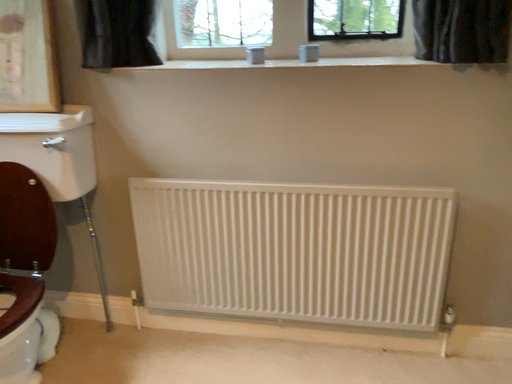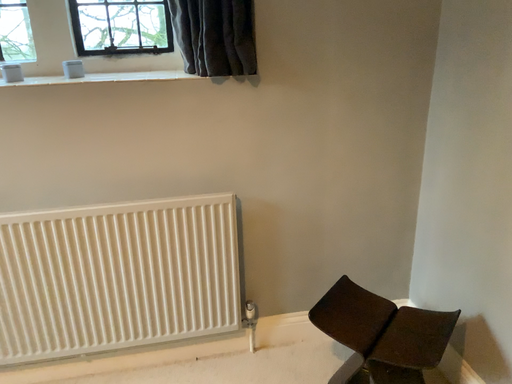
Question: How did the camera likely rotate when shooting the video?

Choices:
 (A) rotated right
 (B) rotated left

Answer: (A)